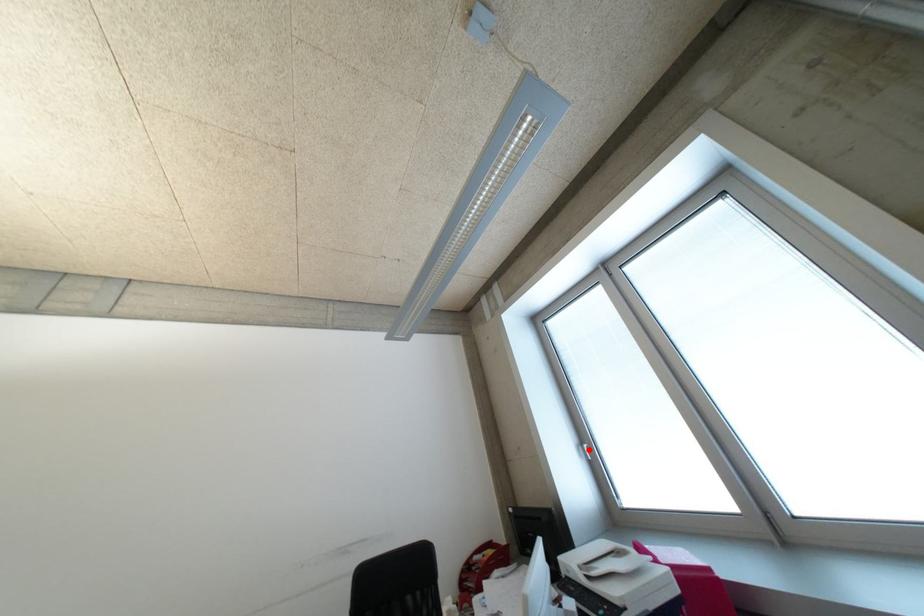
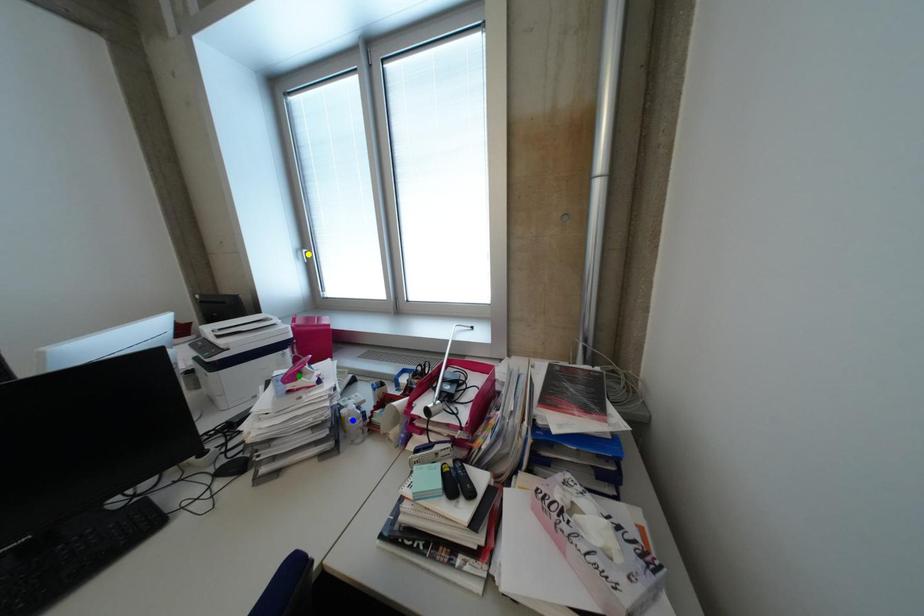
Question: I am providing you with two images of the same scene from different viewpoints. A red point is marked on the first image. You are given multiple points on the second image. Which spot in image 2 lines up with the point in image 1?

Choices:
 (A) yellow point
 (B) green point
 (C) blue point

Answer: (A)